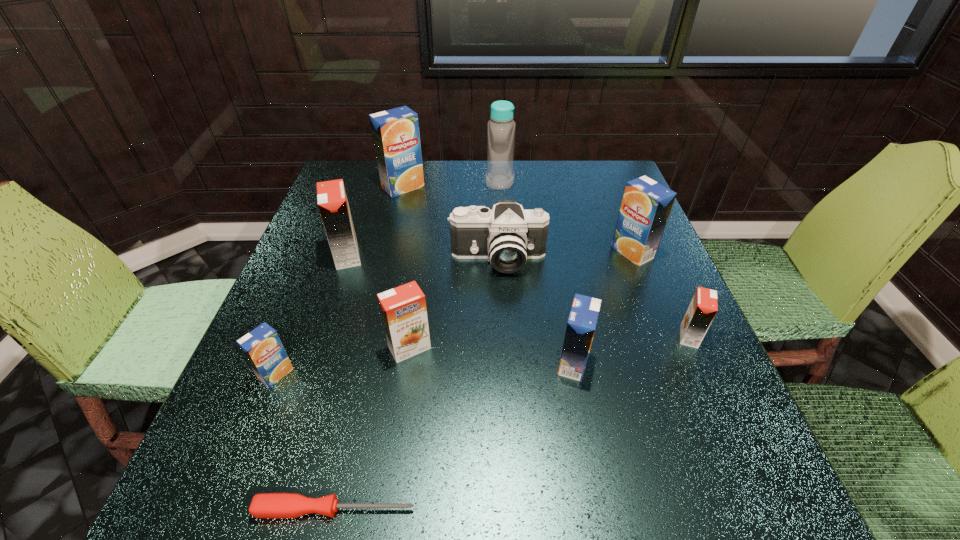
This screenshot has width=960, height=540. I want to click on blue bottle, so click(501, 128).

You are a GUI agent. You are given a task and a screenshot of the screen. Output one action in this format:
    pyautogui.click(x=<x>, y=<y>)
    Task: Click on the farthest blue orange_juice
    This screenshot has width=960, height=540.
    Given the screenshot: What is the action you would take?
    pyautogui.click(x=395, y=132)

Locate an element on the screen. This screenshot has height=540, width=960. the biggest blue orange_juice is located at coordinates (395, 132).

Locate an element on the screen. The height and width of the screenshot is (540, 960). the rightmost blue orange_juice is located at coordinates (646, 205).

You are a GUI agent. You are given a task and a screenshot of the screen. Output one action in this format:
    pyautogui.click(x=<x>, y=<y>)
    Task: Click on the second biggest blue orange_juice
    The height and width of the screenshot is (540, 960).
    Given the screenshot: What is the action you would take?
    646,205

You are a GUI agent. You are given a task and a screenshot of the screen. Output one action in this format:
    pyautogui.click(x=<x>, y=<y>)
    Task: Click on the farthest orange orange juice
    
    Given the screenshot: What is the action you would take?
    pyautogui.click(x=333, y=205)

Find the location of a particular element. The width and height of the screenshot is (960, 540). the leftmost orange orange juice is located at coordinates click(x=333, y=205).

This screenshot has width=960, height=540. I want to click on camera, so click(x=507, y=235).

The width and height of the screenshot is (960, 540). Identify the location of the second smallest orange orange juice. (403, 309).

In order to click on the third blue orange_juice from left to right in this screenshot , I will do `click(582, 321)`.